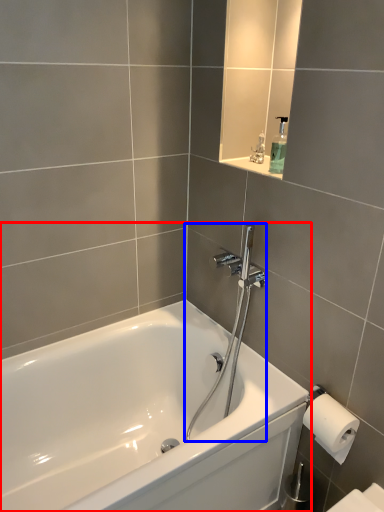
Question: Which object appears farthest to the camera in this image, bathtub (highlighted by a red box) or shower (highlighted by a blue box)?

Choices:
 (A) bathtub
 (B) shower

Answer: (B)